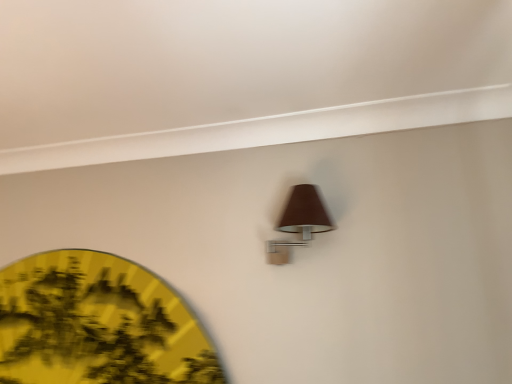
Question: Which is correct: brown fabric lamp at upper center is inside yellow paper fan at lower left, or outside of it?

Choices:
 (A) outside
 (B) inside

Answer: (A)

Question: Based on their positions, is brown fabric lamp at upper center located to the left or right of yellow paper fan at lower left?

Choices:
 (A) right
 (B) left

Answer: (A)

Question: In terms of width, does brown fabric lamp at upper center look wider or thinner when compared to yellow paper fan at lower left?

Choices:
 (A) thin
 (B) wide

Answer: (B)

Question: Is point (44, 291) closer or farther from the camera than point (329, 223)?

Choices:
 (A) closer
 (B) farther

Answer: (B)

Question: Would you say yellow paper fan at lower left is to the left or to the right of brown fabric lamp at upper center in the picture?

Choices:
 (A) right
 (B) left

Answer: (B)

Question: Considering the positions of yellow paper fan at lower left and brown fabric lamp at upper center in the image, is yellow paper fan at lower left wider or thinner than brown fabric lamp at upper center?

Choices:
 (A) wide
 (B) thin

Answer: (B)

Question: From the image's perspective, is yellow paper fan at lower left above or below brown fabric lamp at upper center?

Choices:
 (A) below
 (B) above

Answer: (A)